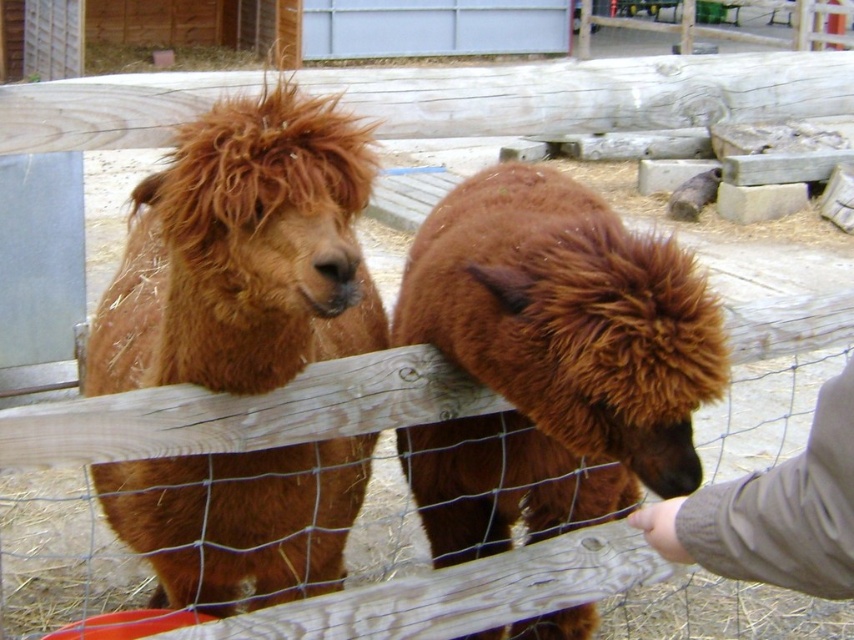
Which is in front, point (395, 531) or point (812, 461)?

Point (812, 461) is more forward.

Is wooden fence at center wider than knitted gray sweater at lower right?

Correct, the width of wooden fence at center exceeds that of knitted gray sweater at lower right.

The image size is (854, 640). What are the coordinates of `wooden fence at center` in the screenshot? It's located at pos(522,588).

This screenshot has width=854, height=640. What are the coordinates of `wooden fence at center` in the screenshot? It's located at (522, 588).

Between brown fluffy camel at center and knitted gray sweater at lower right, which one appears on the left side from the viewer's perspective?

Positioned to the left is brown fluffy camel at center.

Looking at this image, does brown fluffy camel at center appear on the right side of knitted gray sweater at lower right?

In fact, brown fluffy camel at center is to the left of knitted gray sweater at lower right.

Is point (486, 470) behind point (743, 552)?

That is True.

Find the location of `brown fluffy camel at center`. brown fluffy camel at center is located at coordinates (553, 360).

Who is higher up, brown fluffy alpaca at left or brown fluffy camel at center?

brown fluffy alpaca at left is above.

Which is in front, point (288, 252) or point (496, 634)?

Point (288, 252) is in front.

Measure the distance between point (320, 100) and camera.

Point (320, 100) and camera are 4.93 feet apart.

This screenshot has height=640, width=854. Find the location of `brown fluffy alpaca at left`. brown fluffy alpaca at left is located at coordinates 243,252.